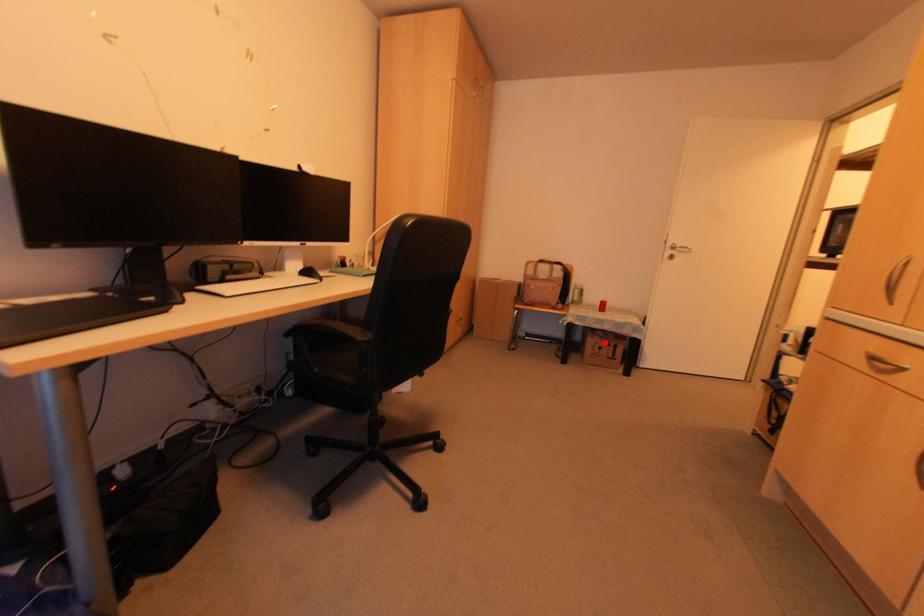
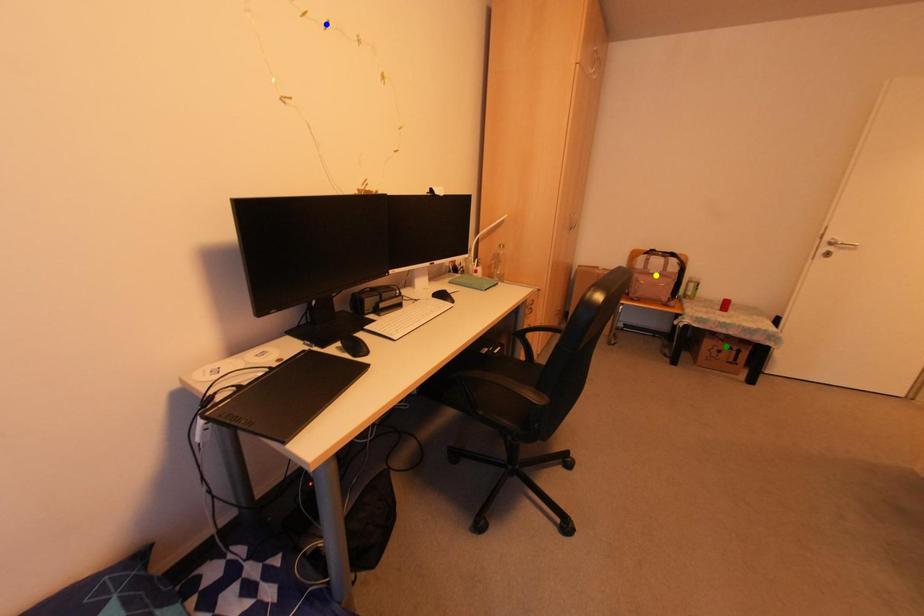
Question: I am providing you with two images of the same scene from different viewpoints. A red point is marked on the first image. You are given multiple points on the second image. Which mark in image 2 goes with the point in image 1?

Choices:
 (A) green point
 (B) yellow point
 (C) blue point

Answer: (A)